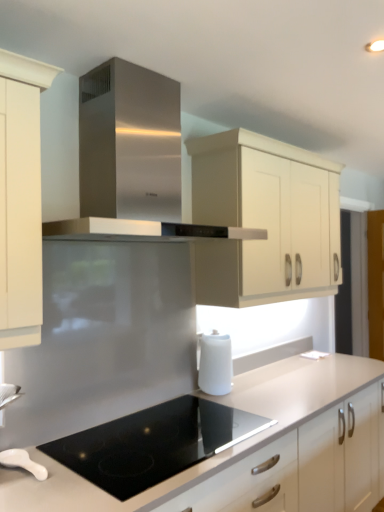
I want to click on vacant point above white glossy spoon at lower left, the second kitchen appliance in the top-to-bottom sequence (from a real-world perspective), so click(x=14, y=457).